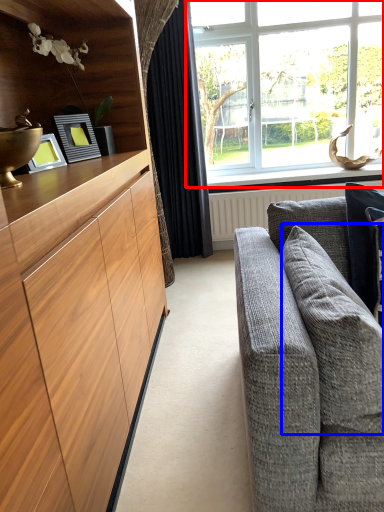
Question: Which of the following is the farthest to the observer, window (highlighted by a red box) or pillow (highlighted by a blue box)?

Choices:
 (A) window
 (B) pillow

Answer: (A)